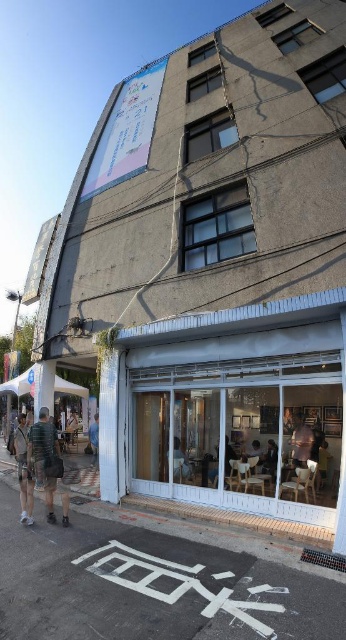
Question: Which of the following is the farthest from the observer?

Choices:
 (A) striped fabric shirt at lower left
 (B) blue fabric bag at lower center
 (C) camouflage fabric shorts at center
 (D) white glass storefront at lower right

Answer: (B)

Question: Which object is farther from the camera taking this photo?

Choices:
 (A) striped fabric shirt at lower left
 (B) camouflage fabric shorts at center
 (C) blue fabric bag at lower center

Answer: (C)

Question: From the image, what is the correct spatial relationship of striped fabric shirt at lower left in relation to blue fabric bag at lower center?

Choices:
 (A) left
 (B) right

Answer: (B)

Question: Does camouflage fabric shorts at center have a larger size compared to blue fabric bag at lower center?

Choices:
 (A) no
 (B) yes

Answer: (A)

Question: Is white glass storefront at lower right positioned before striped fabric shirt at lower left?

Choices:
 (A) no
 (B) yes

Answer: (B)

Question: Which object is the closest to the striped fabric shirt at lower left?

Choices:
 (A) camouflage fabric shorts at center
 (B) blue fabric bag at lower center
 (C) white glass storefront at lower right

Answer: (A)